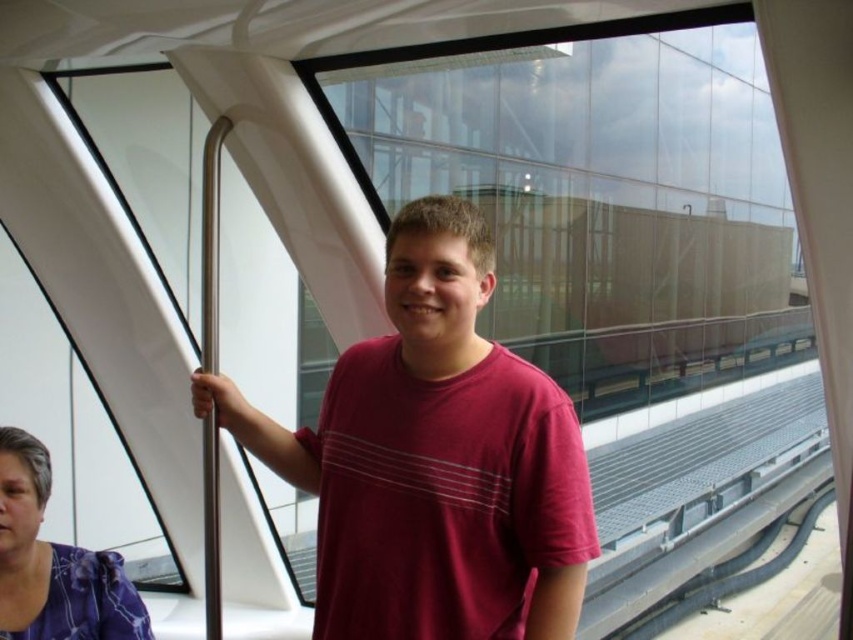
You are inside a futuristic vehicle with large glass windows. You notice two points marked on the window. The first point is at coordinates point (451, 576) and the second is at point (33, 540). From your perspective inside the vehicle, which point is nearer to you?

Point (451, 576) is closer to the camera than point (33, 540).